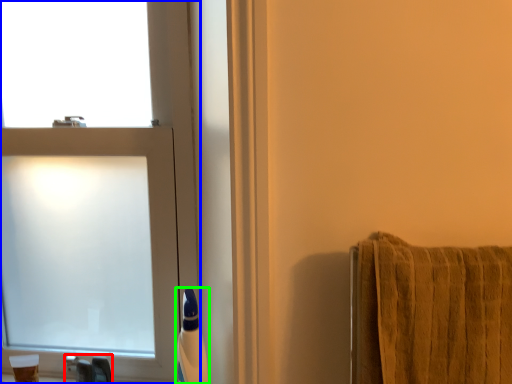
Question: Considering the real-world distances, which object is farthest from faucet (highlighted by a red box)? window (highlighted by a blue box) or toiletry (highlighted by a green box)?

Choices:
 (A) window
 (B) toiletry

Answer: (A)